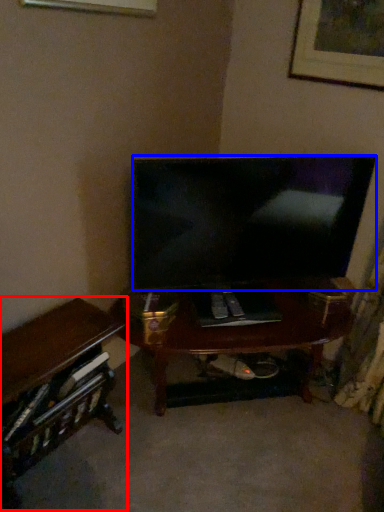
Question: Which object appears farthest to the camera in this image, desk (highlighted by a red box) or television (highlighted by a blue box)?

Choices:
 (A) desk
 (B) television

Answer: (B)